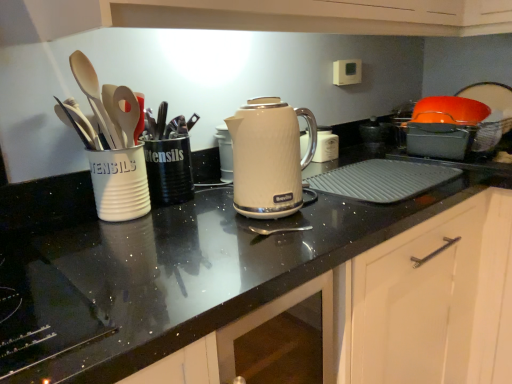
This screenshot has width=512, height=384. In order to click on white glossy electric kettle at center in this screenshot , I will do `click(326, 145)`.

At what (x,y) coordinates should I click in order to perform the action: click on black plastic utensils at center, which appears as the first tableware when viewed from the right. Please return your answer as a coordinate pair (x, y). Looking at the image, I should click on (169, 171).

From the image's perspective, which one is positioned higher, white matte utensils cup at left, which ranks as the first tableware in left-to-right order, or black plastic utensils at center, placed as the 2th tableware when sorted from left to right?

black plastic utensils at center, placed as the 2th tableware when sorted from left to right.

Relative to black plastic utensils at center, placed as the 2th tableware when sorted from left to right, is white matte utensils cup at left, which ranks as the second tableware in right-to-left order, in front or behind?

Clearly, white matte utensils cup at left, which ranks as the second tableware in right-to-left order, is in front of black plastic utensils at center, placed as the 2th tableware when sorted from left to right.

Considering the sizes of white matte utensils cup at left, which ranks as the first tableware in left-to-right order, and black plastic utensils at center, placed as the 2th tableware when sorted from left to right, in the image, is white matte utensils cup at left, which ranks as the first tableware in left-to-right order, wider or thinner than black plastic utensils at center, placed as the 2th tableware when sorted from left to right,?

Clearly, white matte utensils cup at left, which ranks as the first tableware in left-to-right order, has more width compared to black plastic utensils at center, placed as the 2th tableware when sorted from left to right.

How different are the orientations of white matte utensils cup at left, which ranks as the first tableware in left-to-right order, and black plastic utensils at center, placed as the 2th tableware when sorted from left to right, in degrees?

The angular difference between white matte utensils cup at left, which ranks as the first tableware in left-to-right order, and black plastic utensils at center, placed as the 2th tableware when sorted from left to right, is 1.16 degrees.

From a real-world perspective, is white matte cabinet door at lower right, the 2th cabinetry when ordered from left to right, under matte white kettle at center?

Yes, from a real-world perspective, white matte cabinet door at lower right, the 2th cabinetry when ordered from left to right, is beneath matte white kettle at center.

Considering the relative sizes of white matte cabinet door at lower right, the 2th cabinetry positioned from the front, and matte white kettle at center in the image provided, is white matte cabinet door at lower right, the 2th cabinetry positioned from the front, thinner than matte white kettle at center?

Incorrect, the width of white matte cabinet door at lower right, the 2th cabinetry positioned from the front, is not less than that of matte white kettle at center.

Is white matte cabinet door at lower right, placed as the first cabinetry when sorted from back to front, oriented away from matte white kettle at center?

No, white matte cabinet door at lower right, placed as the first cabinetry when sorted from back to front,'s orientation is not away from matte white kettle at center.

Considering the positions of points (185, 178) and (242, 182), is point (185, 178) farther from camera compared to point (242, 182)?

Yes, point (185, 178) is behind point (242, 182).

From a real-world perspective, between black plastic utensils at center, which appears as the first tableware when viewed from the right, and matte white kettle at center, who is vertically lower?

black plastic utensils at center, which appears as the first tableware when viewed from the right, from a real-world perspective.

Is black plastic utensils at center, placed as the 2th tableware when sorted from left to right, at the left side of matte white kettle at center?

Yes, black plastic utensils at center, placed as the 2th tableware when sorted from left to right, is to the left of matte white kettle at center.

Can you confirm if black plastic utensils at center, which appears as the first tableware when viewed from the right, is smaller than matte white kettle at center?

Indeed, black plastic utensils at center, which appears as the first tableware when viewed from the right, has a smaller size compared to matte white kettle at center.

Which of these two, white glossy cabinet at center, placed as the first cabinetry when sorted from left to right, or white matte cabinet door at lower right, which is counted as the first cabinetry, starting from the right, is bigger?

white matte cabinet door at lower right, which is counted as the first cabinetry, starting from the right, is bigger.

Is white glossy cabinet at center, which ranks as the 1th cabinetry in front-to-back order, in front of white matte cabinet door at lower right, the 2th cabinetry when ordered from left to right?

Yes, white glossy cabinet at center, which ranks as the 1th cabinetry in front-to-back order, is in front of white matte cabinet door at lower right, the 2th cabinetry when ordered from left to right.

Measure the distance from white glossy cabinet at center, arranged as the 2th cabinetry when viewed from the back, to white matte cabinet door at lower right, the 2th cabinetry positioned from the front.

white glossy cabinet at center, arranged as the 2th cabinetry when viewed from the back, and white matte cabinet door at lower right, the 2th cabinetry positioned from the front, are 0.79 inches apart.

Does white glossy cabinet at center, arranged as the 2th cabinetry when viewed from the right, have a greater width compared to white matte cabinet door at lower right, the 2th cabinetry positioned from the front?

No, white glossy cabinet at center, arranged as the 2th cabinetry when viewed from the right, is not wider than white matte cabinet door at lower right, the 2th cabinetry positioned from the front.

From the image's perspective, which object appears higher, black plastic utensils at center, placed as the 2th tableware when sorted from left to right, or white glossy electric kettle at center?

white glossy electric kettle at center appears higher in the image.

Based on their positions, is black plastic utensils at center, which appears as the first tableware when viewed from the right, located to the left or right of white glossy electric kettle at center?

black plastic utensils at center, which appears as the first tableware when viewed from the right, is positioned on white glossy electric kettle at center's left side.

Looking at this image, which is correct: black plastic utensils at center, which appears as the first tableware when viewed from the right, is inside white glossy electric kettle at center, or outside of it?

black plastic utensils at center, which appears as the first tableware when viewed from the right, is not enclosed by white glossy electric kettle at center.

Is white matte utensils cup at left, which ranks as the second tableware in right-to-left order, bigger than white matte cabinet door at lower right, the 2th cabinetry positioned from the front?

No.

Is point (146, 192) positioned in front of point (378, 263)?

No.

From a real-world perspective, is white matte utensils cup at left, which ranks as the second tableware in right-to-left order, beneath white matte cabinet door at lower right, the 2th cabinetry positioned from the front?

No, from a real-world perspective, white matte utensils cup at left, which ranks as the second tableware in right-to-left order, is not beneath white matte cabinet door at lower right, the 2th cabinetry positioned from the front.

From the picture: Is there a large distance between white matte utensils cup at left, which ranks as the second tableware in right-to-left order, and white matte cabinet door at lower right, which is counted as the first cabinetry, starting from the right?

white matte utensils cup at left, which ranks as the second tableware in right-to-left order, is actually quite close to white matte cabinet door at lower right, which is counted as the first cabinetry, starting from the right.

From the image's perspective, who appears lower, white matte cabinet door at lower right, the 2th cabinetry when ordered from left to right, or black plastic utensils at center, which appears as the first tableware when viewed from the right?

white matte cabinet door at lower right, the 2th cabinetry when ordered from left to right.

Does white matte cabinet door at lower right, the 2th cabinetry positioned from the front, have a smaller size compared to black plastic utensils at center, placed as the 2th tableware when sorted from left to right?

Actually, white matte cabinet door at lower right, the 2th cabinetry positioned from the front, might be larger than black plastic utensils at center, placed as the 2th tableware when sorted from left to right.

Is white matte cabinet door at lower right, placed as the first cabinetry when sorted from back to front, placed right next to black plastic utensils at center, placed as the 2th tableware when sorted from left to right?

No, white matte cabinet door at lower right, placed as the first cabinetry when sorted from back to front, is not making contact with black plastic utensils at center, placed as the 2th tableware when sorted from left to right.

Where is `tableware directly beneath the black plastic utensils at center, which appears as the first tableware when viewed from the right (from a real-world perspective)`? The width and height of the screenshot is (512, 384). tableware directly beneath the black plastic utensils at center, which appears as the first tableware when viewed from the right (from a real-world perspective) is located at coordinates (119, 183).

Locate an element on the screen. The image size is (512, 384). kettle located above the white matte cabinet door at lower right, placed as the first cabinetry when sorted from back to front (from a real-world perspective) is located at coordinates (269, 157).

When comparing their distances from white matte cabinet door at lower right, the 2th cabinetry when ordered from left to right, does white glossy cabinet at center, which ranks as the 1th cabinetry in front-to-back order, or matte white kettle at center seem further?

matte white kettle at center lies further to white matte cabinet door at lower right, the 2th cabinetry when ordered from left to right, than the other object.

Estimate the real-world distances between objects in this image. Which object is further from white glossy electric kettle at center, black plastic utensils at center, which appears as the first tableware when viewed from the right, or white matte cabinet door at lower right, which is counted as the first cabinetry, starting from the right?

The object further to white glossy electric kettle at center is white matte cabinet door at lower right, which is counted as the first cabinetry, starting from the right.

Estimate the real-world distances between objects in this image. Which object is further from matte white kettle at center, white matte utensils cup at left, which ranks as the second tableware in right-to-left order, or white glossy electric kettle at center?

white glossy electric kettle at center.

Estimate the real-world distances between objects in this image. Which object is further from white glossy cabinet at center, arranged as the 2th cabinetry when viewed from the right, white matte utensils cup at left, which ranks as the second tableware in right-to-left order, or black plastic utensils at center, which appears as the first tableware when viewed from the right?

Among the two, white matte utensils cup at left, which ranks as the second tableware in right-to-left order, is located further to white glossy cabinet at center, arranged as the 2th cabinetry when viewed from the right.

Based on their spatial positions, is black plastic utensils at center, which appears as the first tableware when viewed from the right, or white matte cabinet door at lower right, placed as the first cabinetry when sorted from back to front, further from white matte utensils cup at left, which ranks as the second tableware in right-to-left order?

The object further to white matte utensils cup at left, which ranks as the second tableware in right-to-left order, is white matte cabinet door at lower right, placed as the first cabinetry when sorted from back to front.

From the image, which object appears to be nearer to white matte cabinet door at lower right, the 2th cabinetry when ordered from left to right, white matte utensils cup at left, which ranks as the second tableware in right-to-left order, or white glossy cabinet at center, arranged as the 2th cabinetry when viewed from the right?

white glossy cabinet at center, arranged as the 2th cabinetry when viewed from the right.

Which object lies nearer to the anchor point white matte cabinet door at lower right, which is counted as the first cabinetry, starting from the right, white glossy electric kettle at center or white matte utensils cup at left, which ranks as the second tableware in right-to-left order?

Based on the image, white glossy electric kettle at center appears to be nearer to white matte cabinet door at lower right, which is counted as the first cabinetry, starting from the right.

Based on their spatial positions, is black plastic utensils at center, placed as the 2th tableware when sorted from left to right, or white glossy cabinet at center, placed as the first cabinetry when sorted from left to right, further from matte white kettle at center?

white glossy cabinet at center, placed as the first cabinetry when sorted from left to right, is further to matte white kettle at center.

This screenshot has height=384, width=512. Find the location of `kettle between white glossy cabinet at center, which ranks as the 1th cabinetry in front-to-back order, and white matte cabinet door at lower right, the 2th cabinetry when ordered from left to right, from left to right`. kettle between white glossy cabinet at center, which ranks as the 1th cabinetry in front-to-back order, and white matte cabinet door at lower right, the 2th cabinetry when ordered from left to right, from left to right is located at coordinates (269, 157).

Where is `cabinetry between black plastic utensils at center, placed as the 2th tableware when sorted from left to right, and white matte cabinet door at lower right, the 2th cabinetry when ordered from left to right`? cabinetry between black plastic utensils at center, placed as the 2th tableware when sorted from left to right, and white matte cabinet door at lower right, the 2th cabinetry when ordered from left to right is located at coordinates (395, 309).

You are a GUI agent. You are given a task and a screenshot of the screen. Output one action in this format:
    pyautogui.click(x=<x>, y=<y>)
    Task: Click on the tableware between white matte utensils cup at left, which ranks as the first tableware in left-to-right order, and white matte cabinet door at lower right, the 2th cabinetry positioned from the front
    
    Given the screenshot: What is the action you would take?
    pyautogui.click(x=169, y=171)

At what (x,y) coordinates should I click in order to perform the action: click on appliance located between black plastic utensils at center, which appears as the first tableware when viewed from the right, and white matte cabinet door at lower right, placed as the first cabinetry when sorted from back to front, in the left-right direction. Please return your answer as a coordinate pair (x, y). This screenshot has width=512, height=384. Looking at the image, I should click on (326, 145).